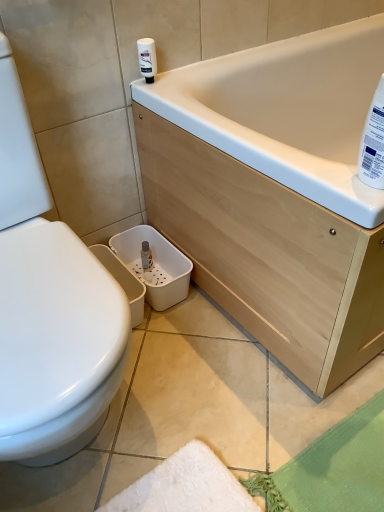
In order to click on white plastic bottle at upper center, which is the 1th cleaning product in back-to-front order in this screenshot , I will do `click(147, 58)`.

This screenshot has width=384, height=512. What do you see at coordinates (147, 58) in the screenshot? I see `white plastic bottle at upper center, the second cleaning product from the right` at bounding box center [147, 58].

What is the approximate height of white plastic bottle at upper center, the 2th cleaning product ordered from the bottom?

white plastic bottle at upper center, the 2th cleaning product ordered from the bottom, is 4.31 inches in height.

Measure the distance between point (367, 181) and camera.

A distance of 68.70 centimeters exists between point (367, 181) and camera.

Image resolution: width=384 pixels, height=512 pixels. What are the coordinates of `white plastic bottle at upper right, the 1th cleaning product ordered from the bottom` in the screenshot? It's located at (373, 142).

What do you see at coordinates (373, 142) in the screenshot? This screenshot has width=384, height=512. I see `white plastic bottle at upper right, placed as the 2th cleaning product when sorted from back to front` at bounding box center [373, 142].

Where is `white plastic bottle at upper center, which is counted as the second cleaning product, starting from the front`? This screenshot has height=512, width=384. white plastic bottle at upper center, which is counted as the second cleaning product, starting from the front is located at coordinates (147, 58).

Does white plastic bottle at upper center, the 2th cleaning product ordered from the bottom, appear on the left side of white plastic bottle at upper right, the second cleaning product from the top?

Correct, you'll find white plastic bottle at upper center, the 2th cleaning product ordered from the bottom, to the left of white plastic bottle at upper right, the second cleaning product from the top.

Does white plastic bottle at upper center, the second cleaning product from the right, lie behind white plastic bottle at upper right, the first cleaning product viewed from the right?

Yes.

Considering the positions of point (147, 54) and point (380, 121), is point (147, 54) closer or farther from the camera than point (380, 121)?

Point (147, 54) is positioned farther from the camera compared to point (380, 121).

From the image's perspective, relative to white plastic bottle at upper right, the 1th cleaning product ordered from the bottom, is white plastic bottle at upper center, which is the 1th cleaning product in left-to-right order, above or below?

Clearly, from the image's perspective, white plastic bottle at upper center, which is the 1th cleaning product in left-to-right order, is above white plastic bottle at upper right, the 1th cleaning product ordered from the bottom.

From a real-world perspective, is white plastic bottle at upper center, the second cleaning product from the right, positioned above or below white plastic bottle at upper right, which ranks as the 1th cleaning product in front-to-back order?

In terms of real-world spatial position, white plastic bottle at upper center, the second cleaning product from the right, is below white plastic bottle at upper right, which ranks as the 1th cleaning product in front-to-back order.

Looking at their sizes, would you say white plastic bottle at upper center, the first cleaning product positioned from the top, is wider or thinner than white plastic bottle at upper right, the second cleaning product from the top?

In the image, white plastic bottle at upper center, the first cleaning product positioned from the top, appears to be more narrow than white plastic bottle at upper right, the second cleaning product from the top.

From their relative heights in the image, would you say white plastic bottle at upper center, which is the 1th cleaning product in back-to-front order, is taller or shorter than white plastic bottle at upper right, the second cleaning product from the top?

white plastic bottle at upper center, which is the 1th cleaning product in back-to-front order, is shorter than white plastic bottle at upper right, the second cleaning product from the top.

Does white plastic bottle at upper center, the 2th cleaning product ordered from the bottom, have a smaller size compared to white plastic bottle at upper right, the 1th cleaning product ordered from the bottom?

Yes, white plastic bottle at upper center, the 2th cleaning product ordered from the bottom, is smaller than white plastic bottle at upper right, the 1th cleaning product ordered from the bottom.

From the picture: Would you say white plastic bottle at upper right, the 1th cleaning product ordered from the bottom, is part of white plastic bottle at upper center, the second cleaning product from the right,'s contents?

No.

Is white plastic bottle at upper center, which is counted as the second cleaning product, starting from the front, touching white plastic bottle at upper right, the second cleaning product from the top?

white plastic bottle at upper center, which is counted as the second cleaning product, starting from the front, is not next to white plastic bottle at upper right, the second cleaning product from the top, and they're not touching.

Could you tell me if white plastic bottle at upper center, the first cleaning product positioned from the top, is turned towards white plastic bottle at upper right, which ranks as the 1th cleaning product in front-to-back order?

Yes, white plastic bottle at upper center, the first cleaning product positioned from the top, is turned towards white plastic bottle at upper right, which ranks as the 1th cleaning product in front-to-back order.

Where is `cleaning product in front of the white plastic bottle at upper center, which is the 1th cleaning product in back-to-front order`? The height and width of the screenshot is (512, 384). cleaning product in front of the white plastic bottle at upper center, which is the 1th cleaning product in back-to-front order is located at coordinates (373, 142).

Considering the relative positions of white plastic bottle at upper right, the second cleaning product from the left, and white plastic bottle at upper center, the second cleaning product from the right, in the image provided, is white plastic bottle at upper right, the second cleaning product from the left, to the left of white plastic bottle at upper center, the second cleaning product from the right, from the viewer's perspective?

No, white plastic bottle at upper right, the second cleaning product from the left, is not to the left of white plastic bottle at upper center, the second cleaning product from the right.

Is white plastic bottle at upper right, placed as the 2th cleaning product when sorted from back to front, behind white plastic bottle at upper center, the 2th cleaning product ordered from the bottom?

That is False.

Which point is more distant from viewer, (363, 152) or (147, 63)?

The point (147, 63) is behind.

From the image's perspective, who appears lower, white plastic bottle at upper right, the 1th cleaning product ordered from the bottom, or white plastic bottle at upper center, the 2th cleaning product ordered from the bottom?

white plastic bottle at upper right, the 1th cleaning product ordered from the bottom, appears lower in the image.

From a real-world perspective, does white plastic bottle at upper right, the 1th cleaning product ordered from the bottom, sit lower than white plastic bottle at upper center, which is counted as the second cleaning product, starting from the front?

No, from a real-world perspective, white plastic bottle at upper right, the 1th cleaning product ordered from the bottom, is not under white plastic bottle at upper center, which is counted as the second cleaning product, starting from the front.

Does white plastic bottle at upper right, the second cleaning product from the top, have a greater width compared to white plastic bottle at upper center, the second cleaning product from the right?

Correct, the width of white plastic bottle at upper right, the second cleaning product from the top, exceeds that of white plastic bottle at upper center, the second cleaning product from the right.

Which of these two, white plastic bottle at upper right, which ranks as the 1th cleaning product in front-to-back order, or white plastic bottle at upper center, which is the 1th cleaning product in left-to-right order, stands taller?

white plastic bottle at upper right, which ranks as the 1th cleaning product in front-to-back order.

Is white plastic bottle at upper right, placed as the 2th cleaning product when sorted from back to front, bigger than white plastic bottle at upper center, the 2th cleaning product ordered from the bottom?

Yes.

Can we say white plastic bottle at upper right, the second cleaning product from the top, lies outside white plastic bottle at upper center, the 2th cleaning product ordered from the bottom?

white plastic bottle at upper right, the second cleaning product from the top, is positioned outside white plastic bottle at upper center, the 2th cleaning product ordered from the bottom.

Is white plastic bottle at upper right, the 1th cleaning product ordered from the bottom, not near white plastic bottle at upper center, which is counted as the second cleaning product, starting from the front?

No, there isn't a large distance between white plastic bottle at upper right, the 1th cleaning product ordered from the bottom, and white plastic bottle at upper center, which is counted as the second cleaning product, starting from the front.

Is white plastic bottle at upper right, placed as the 2th cleaning product when sorted from back to front, looking in the opposite direction of white plastic bottle at upper center, which is counted as the second cleaning product, starting from the front?

That's right, white plastic bottle at upper right, placed as the 2th cleaning product when sorted from back to front, is facing away from white plastic bottle at upper center, which is counted as the second cleaning product, starting from the front.

How much distance is there between white plastic bottle at upper right, the second cleaning product from the top, and white plastic bottle at upper center, the 2th cleaning product ordered from the bottom?

A distance of 23.29 inches exists between white plastic bottle at upper right, the second cleaning product from the top, and white plastic bottle at upper center, the 2th cleaning product ordered from the bottom.

The image size is (384, 512). I want to click on cleaning product below the white plastic bottle at upper right, which ranks as the 1th cleaning product in front-to-back order (from a real-world perspective), so click(x=147, y=58).

You are a GUI agent. You are given a task and a screenshot of the screen. Output one action in this format:
    pyautogui.click(x=<x>, y=<y>)
    Task: Click on the cleaning product beneath the white plastic bottle at upper right, placed as the 2th cleaning product when sorted from back to front (from a real-world perspective)
    Image resolution: width=384 pixels, height=512 pixels.
    Given the screenshot: What is the action you would take?
    pyautogui.click(x=147, y=58)

Find the location of a particular element. The image size is (384, 512). cleaning product that appears above the white plastic bottle at upper center, the first cleaning product positioned from the top (from a real-world perspective) is located at coordinates (373, 142).